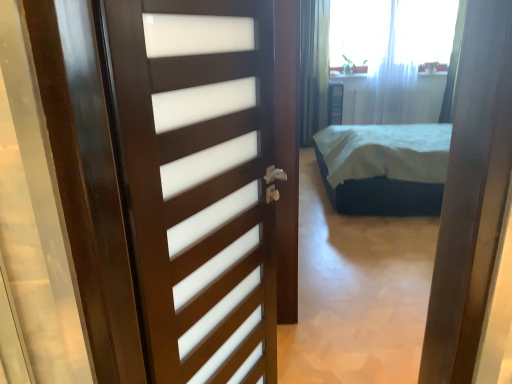
Describe the element at coordinates (392, 31) in the screenshot. Image resolution: width=512 pixels, height=384 pixels. I see `white sheer curtain at upper center` at that location.

Image resolution: width=512 pixels, height=384 pixels. Find the location of `dark wood door at center`. dark wood door at center is located at coordinates (199, 181).

What is the approximate width of dark wood door at center?

It is 4.01 inches.

Where is `white sheer curtain at upper center`? white sheer curtain at upper center is located at coordinates (392, 31).

How different are the orientations of white sheer curtain at upper center, placed as the second curtain when sorted from right to left, and white sheer curtain at upper center in degrees?

The facing directions of white sheer curtain at upper center, placed as the second curtain when sorted from right to left, and white sheer curtain at upper center are 6.67e-06 degrees apart.

Which of these two, white sheer curtain at upper center, arranged as the first curtain when viewed from the left, or white sheer curtain at upper center, is smaller?

Smaller between the two is white sheer curtain at upper center.

Choose the correct answer: Is white sheer curtain at upper center, arranged as the first curtain when viewed from the left, inside white sheer curtain at upper center or outside it?

white sheer curtain at upper center, arranged as the first curtain when viewed from the left, is not enclosed by white sheer curtain at upper center.

Visually, is white sheer curtain at upper center, placed as the second curtain when sorted from right to left, positioned to the left or to the right of white sheer curtain at upper center?

white sheer curtain at upper center, placed as the second curtain when sorted from right to left, is positioned on white sheer curtain at upper center's left side.

Is white sheer curtain at upper center in front of or behind white sheer curtain at upper center, arranged as the first curtain when viewed from the left, in the image?

Clearly, white sheer curtain at upper center is behind white sheer curtain at upper center, arranged as the first curtain when viewed from the left.

Is point (350, 17) closer or farther from the camera than point (393, 33)?

Point (350, 17) appears to be closer to the viewer than point (393, 33).

From a real-world perspective, which object rests below the other?

From a 3D spatial view, white sheer curtain at upper center, placed as the second curtain when sorted from right to left, is below.

Can white sheer curtain at upper center, arranged as the first curtain when viewed from the left, be found inside white sheer curtain at upper center?

That's incorrect, white sheer curtain at upper center, arranged as the first curtain when viewed from the left, is not inside white sheer curtain at upper center.

This screenshot has height=384, width=512. Identify the location of door above the dark blue fabric bed at center (from a real-world perspective). (199, 181).

Are dark blue fabric bed at center and dark wood door at center making contact?

dark blue fabric bed at center and dark wood door at center are not in contact.

From a real-world perspective, is dark blue fabric bed at center located higher than dark wood door at center?

No, from a real-world perspective, dark blue fabric bed at center is not on top of dark wood door at center.

What's the angular difference between white sheer curtain at upper right, the second curtain viewed from the left, and white sheer curtain at upper center, arranged as the first curtain when viewed from the left,'s facing directions?

0.000496 degrees separate the facing orientations of white sheer curtain at upper right, the second curtain viewed from the left, and white sheer curtain at upper center, arranged as the first curtain when viewed from the left.

Would you say white sheer curtain at upper right, acting as the 1th curtain starting from the right, contains white sheer curtain at upper center, placed as the second curtain when sorted from right to left?

No, white sheer curtain at upper center, placed as the second curtain when sorted from right to left, is not surrounded by white sheer curtain at upper right, acting as the 1th curtain starting from the right.

Considering their positions, is white sheer curtain at upper right, the second curtain viewed from the left, located in front of or behind white sheer curtain at upper center, arranged as the first curtain when viewed from the left?

Clearly, white sheer curtain at upper right, the second curtain viewed from the left, is in front of white sheer curtain at upper center, arranged as the first curtain when viewed from the left.

Which of these two, white sheer curtain at upper right, acting as the 1th curtain starting from the right, or white sheer curtain at upper center, placed as the second curtain when sorted from right to left, stands taller?

Standing taller between the two is white sheer curtain at upper center, placed as the second curtain when sorted from right to left.

Is white sheer curtain at upper right, acting as the 1th curtain starting from the right, in contact with dark blue fabric bed at center?

They are not placed beside each other.

Find the location of a particular element. The width and height of the screenshot is (512, 384). bed on the left of white sheer curtain at upper right, acting as the 1th curtain starting from the right is located at coordinates (384, 168).

Which is closer, (453,75) or (355,144)?

Point (453,75) is farther from the camera than point (355,144).

From the image's perspective, which is above, white sheer curtain at upper right, acting as the 1th curtain starting from the right, or dark blue fabric bed at center?

white sheer curtain at upper right, acting as the 1th curtain starting from the right, appears higher in the image.

From the image's perspective, who appears lower, white sheer curtain at upper center or dark wood door at center?

dark wood door at center is shown below in the image.

Is white sheer curtain at upper center facing away from dark wood door at center?

white sheer curtain at upper center is not turned away from dark wood door at center.

Which of these two, white sheer curtain at upper center or dark wood door at center, stands taller?

dark wood door at center is taller.

Does white sheer curtain at upper center appear on the right side of dark wood door at center?

Yes, white sheer curtain at upper center is to the right of dark wood door at center.

How many degrees apart are the facing directions of white sheer curtain at upper right, acting as the 1th curtain starting from the right, and dark wood door at center?

63.2 degrees separate the facing orientations of white sheer curtain at upper right, acting as the 1th curtain starting from the right, and dark wood door at center.

Considering the sizes of white sheer curtain at upper right, acting as the 1th curtain starting from the right, and dark wood door at center in the image, is white sheer curtain at upper right, acting as the 1th curtain starting from the right, bigger or smaller than dark wood door at center?

Clearly, white sheer curtain at upper right, acting as the 1th curtain starting from the right, is larger in size than dark wood door at center.

Considering the relative sizes of white sheer curtain at upper right, acting as the 1th curtain starting from the right, and dark wood door at center in the image provided, is white sheer curtain at upper right, acting as the 1th curtain starting from the right, taller than dark wood door at center?

Indeed, white sheer curtain at upper right, acting as the 1th curtain starting from the right, has a greater height compared to dark wood door at center.

Identify the location of window screen above the white sheer curtain at upper center, placed as the second curtain when sorted from right to left (from a real-world perspective). (392, 31).

Image resolution: width=512 pixels, height=384 pixels. I want to click on window screen above the white sheer curtain at upper center, arranged as the first curtain when viewed from the left (from the image's perspective), so click(392, 31).

Based on their spatial positions, is dark blue fabric bed at center or white sheer curtain at upper center further from white sheer curtain at upper center, arranged as the first curtain when viewed from the left?

dark blue fabric bed at center is positioned further to the anchor white sheer curtain at upper center, arranged as the first curtain when viewed from the left.

From the image, which object appears to be nearer to white sheer curtain at upper center, dark blue fabric bed at center or white sheer curtain at upper center, placed as the second curtain when sorted from right to left?

white sheer curtain at upper center, placed as the second curtain when sorted from right to left.

Looking at the image, which one is located closer to dark blue fabric bed at center, white sheer curtain at upper center, placed as the second curtain when sorted from right to left, or white sheer curtain at upper center?

Based on the image, white sheer curtain at upper center, placed as the second curtain when sorted from right to left, appears to be nearer to dark blue fabric bed at center.

Estimate the real-world distances between objects in this image. Which object is further from dark wood door at center, white sheer curtain at upper center, placed as the second curtain when sorted from right to left, or white sheer curtain at upper center?

white sheer curtain at upper center, placed as the second curtain when sorted from right to left, is positioned further to the anchor dark wood door at center.

From the image, which object appears to be farther from dark blue fabric bed at center, white sheer curtain at upper right, the second curtain viewed from the left, or white sheer curtain at upper center, arranged as the first curtain when viewed from the left?

white sheer curtain at upper center, arranged as the first curtain when viewed from the left, lies further to dark blue fabric bed at center than the other object.

Which object lies nearer to the anchor point white sheer curtain at upper right, the second curtain viewed from the left, dark blue fabric bed at center or dark wood door at center?

The object closer to white sheer curtain at upper right, the second curtain viewed from the left, is dark blue fabric bed at center.

Which object lies nearer to the anchor point white sheer curtain at upper center, dark blue fabric bed at center or dark wood door at center?

Based on the image, dark blue fabric bed at center appears to be nearer to white sheer curtain at upper center.

When comparing their distances from white sheer curtain at upper center, arranged as the first curtain when viewed from the left, does white sheer curtain at upper right, the second curtain viewed from the left, or dark blue fabric bed at center seem further?

Based on the image, dark blue fabric bed at center appears to be further to white sheer curtain at upper center, arranged as the first curtain when viewed from the left.

This screenshot has width=512, height=384. What are the coordinates of `curtain between dark blue fabric bed at center and white sheer curtain at upper center, arranged as the first curtain when viewed from the left, along the z-axis` in the screenshot? It's located at (453, 66).

Identify the location of curtain between dark wood door at center and white sheer curtain at upper center, placed as the second curtain when sorted from right to left, in the front-back direction. The height and width of the screenshot is (384, 512). (453, 66).

The width and height of the screenshot is (512, 384). In order to click on bed located between dark wood door at center and white sheer curtain at upper right, the second curtain viewed from the left, in the depth direction in this screenshot , I will do (x=384, y=168).

This screenshot has height=384, width=512. Find the location of `bed between dark wood door at center and white sheer curtain at upper center, placed as the second curtain when sorted from right to left, from front to back`. bed between dark wood door at center and white sheer curtain at upper center, placed as the second curtain when sorted from right to left, from front to back is located at coordinates (384, 168).